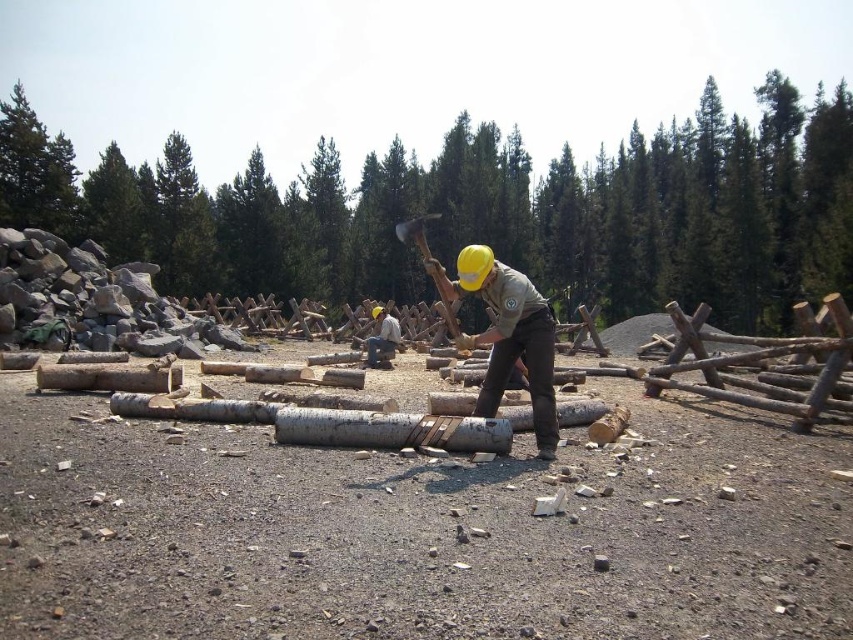
You are a safety inspector checking the work area. The smooth wooden logs at center and the wooden hatchet at center are in the work area. According to safety regulations, tools must be kept at least 1 meter away from any unstable or elevated objects. Are these two items compliant with this rule?

The smooth wooden logs at center is much taller as wooden hatchet at center, so the wooden hatchet at center is not compliant with the safety regulations because it is placed too close to an elevated object.